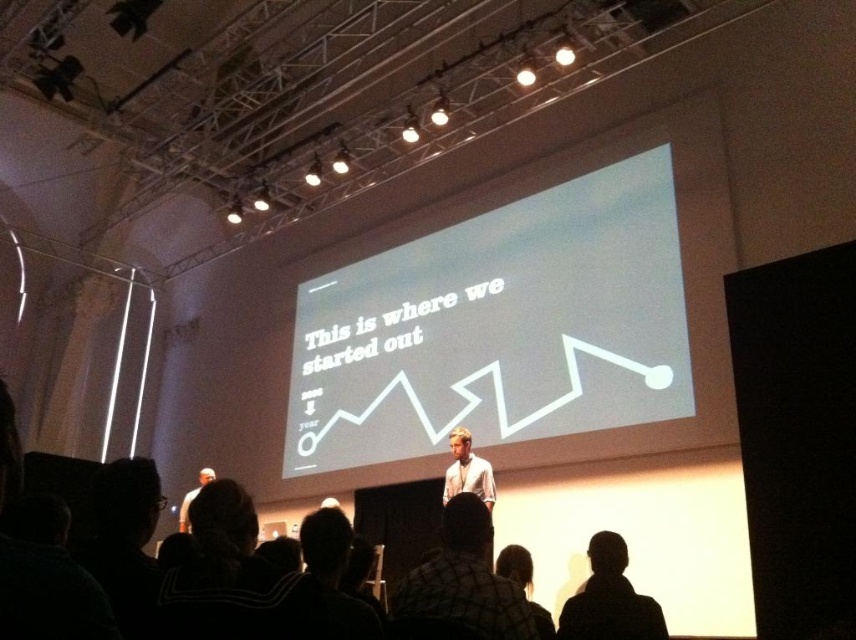
Who is positioned more to the left, white matte projection screen at upper center or dark hair at lower center?

white matte projection screen at upper center

Between point (415, 305) and point (518, 545), which one is positioned behind?

Point (415, 305)

Locate an element on the screen. This screenshot has height=640, width=856. white matte projection screen at upper center is located at coordinates (498, 326).

From the picture: Is plaid shirt at center bigger than black hair at lower center?

Incorrect, plaid shirt at center is not larger than black hair at lower center.

Between plaid shirt at center and black hair at lower center, which one has more height?

plaid shirt at center

Which is in front, point (455, 497) or point (633, 634)?

Positioned in front is point (633, 634).

The width and height of the screenshot is (856, 640). Find the location of `plaid shirt at center`. plaid shirt at center is located at coordinates tap(462, 582).

Does plaid shirt at center have a lesser width compared to white shirt at center?

Indeed, plaid shirt at center has a lesser width compared to white shirt at center.

Who is lower down, plaid shirt at center or white shirt at center?

white shirt at center

Does point (465, 609) lie behind point (204, 474)?

No, it is not.

The image size is (856, 640). Identify the location of plaid shirt at center. (462, 582).